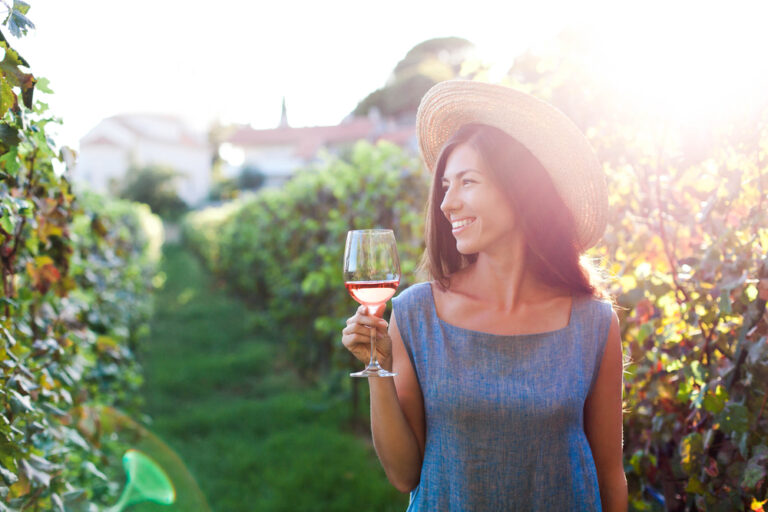
This screenshot has width=768, height=512. I want to click on wine glass, so click(x=369, y=260).